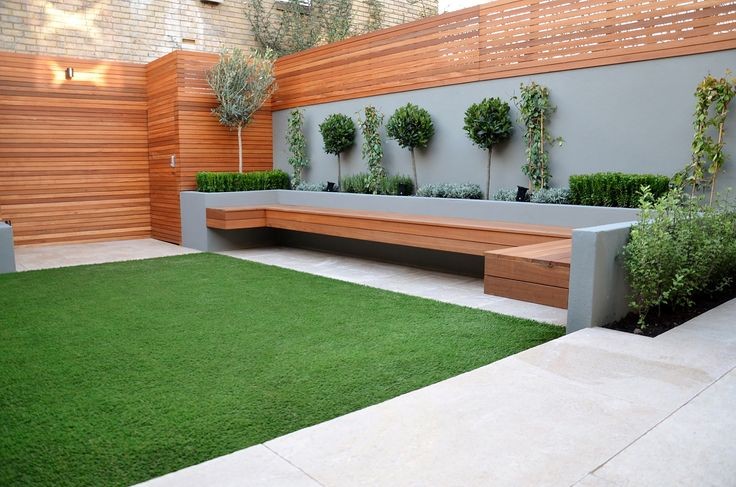
This screenshot has height=487, width=736. I want to click on grout lines, so click(x=305, y=472), click(x=628, y=444), click(x=595, y=477).